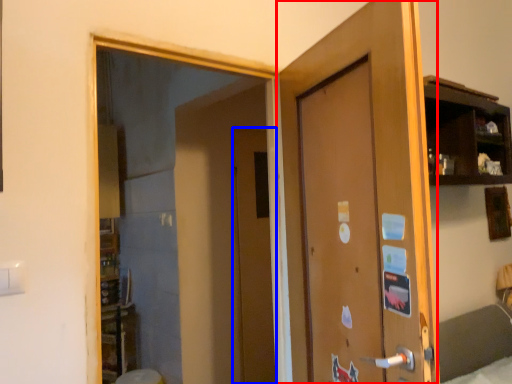
Question: Which point is further to the camera, door (highlighted by a red box) or door (highlighted by a blue box)?

Choices:
 (A) door
 (B) door

Answer: (B)